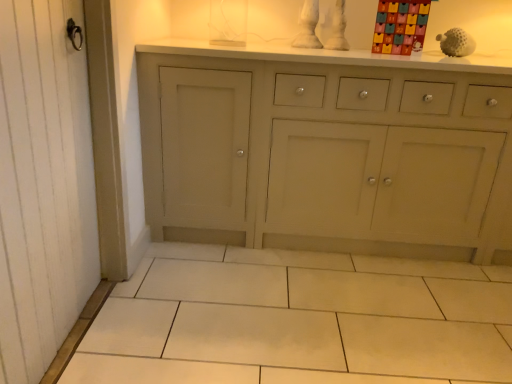
Question: Is white matte golf ball at upper right, acting as the 2th toy starting from the left, located within multicolored cardboard advent calendar at upper right, the 1th toy viewed from the left?

Choices:
 (A) yes
 (B) no

Answer: (B)

Question: From a real-world perspective, does multicolored cardboard advent calendar at upper right, the 1th toy viewed from the left, sit lower than white matte golf ball at upper right, which is the 1th toy in right-to-left order?

Choices:
 (A) no
 (B) yes

Answer: (A)

Question: Could you tell me if multicolored cardboard advent calendar at upper right, the 1th toy viewed from the left, is facing white matte golf ball at upper right, acting as the 2th toy starting from the left?

Choices:
 (A) yes
 (B) no

Answer: (B)

Question: From the image's perspective, does multicolored cardboard advent calendar at upper right, marked as the second toy in a right-to-left arrangement, appear lower than white matte golf ball at upper right, acting as the 2th toy starting from the left?

Choices:
 (A) yes
 (B) no

Answer: (B)

Question: From the image's perspective, would you say multicolored cardboard advent calendar at upper right, marked as the second toy in a right-to-left arrangement, is positioned over white matte golf ball at upper right, acting as the 2th toy starting from the left?

Choices:
 (A) yes
 (B) no

Answer: (A)

Question: Considering the positions of white matte golf ball at upper right, acting as the 2th toy starting from the left, and multicolored cardboard advent calendar at upper right, marked as the second toy in a right-to-left arrangement, in the image, is white matte golf ball at upper right, acting as the 2th toy starting from the left, bigger or smaller than multicolored cardboard advent calendar at upper right, marked as the second toy in a right-to-left arrangement,?

Choices:
 (A) small
 (B) big

Answer: (A)

Question: Is point [452, 54] positioned closer to the camera than point [407, 46]?

Choices:
 (A) farther
 (B) closer

Answer: (A)

Question: From the image's perspective, relative to multicolored cardboard advent calendar at upper right, marked as the second toy in a right-to-left arrangement, is white matte golf ball at upper right, acting as the 2th toy starting from the left, above or below?

Choices:
 (A) above
 (B) below

Answer: (B)

Question: Is white matte golf ball at upper right, which is the 1th toy in right-to-left order, wider or thinner than multicolored cardboard advent calendar at upper right, the 1th toy viewed from the left?

Choices:
 (A) thin
 (B) wide

Answer: (B)

Question: From the image's perspective, relative to white matte golf ball at upper right, which is the 1th toy in right-to-left order, is white wood screen door at left above or below?

Choices:
 (A) above
 (B) below

Answer: (B)

Question: From their relative heights in the image, would you say white wood screen door at left is taller or shorter than white matte golf ball at upper right, acting as the 2th toy starting from the left?

Choices:
 (A) tall
 (B) short

Answer: (A)

Question: Considering their positions, is white wood screen door at left located in front of or behind white matte golf ball at upper right, which is the 1th toy in right-to-left order?

Choices:
 (A) front
 (B) behind

Answer: (A)

Question: Is white wood screen door at left wider or thinner than white matte golf ball at upper right, acting as the 2th toy starting from the left?

Choices:
 (A) thin
 (B) wide

Answer: (A)

Question: Looking at the image, does multicolored cardboard advent calendar at upper right, the 1th toy viewed from the left, seem bigger or smaller compared to white matte golf ball at upper right, which is the 1th toy in right-to-left order?

Choices:
 (A) small
 (B) big

Answer: (B)

Question: Looking at their shapes, would you say multicolored cardboard advent calendar at upper right, marked as the second toy in a right-to-left arrangement, is wider or thinner than white matte golf ball at upper right, which is the 1th toy in right-to-left order?

Choices:
 (A) wide
 (B) thin

Answer: (B)